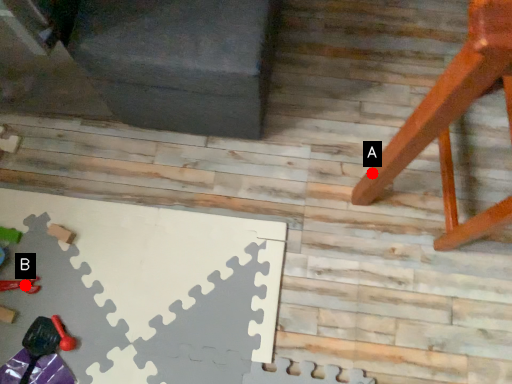
Question: Two points are circled on the image, labeled by A and B beside each circle. Which of the following is the closest to the observer?

Choices:
 (A) A is closer
 (B) B is closer

Answer: (A)